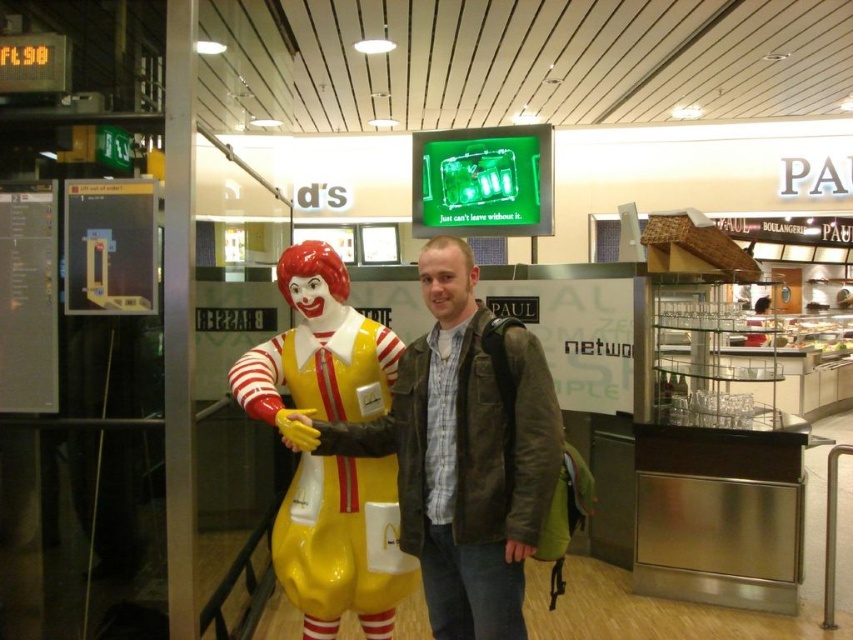
Question: Which point is farther to the camera?

Choices:
 (A) pos(483,497)
 (B) pos(372,467)

Answer: (B)

Question: Is brown leather jacket at center smaller than yellow glossy clown at center?

Choices:
 (A) yes
 (B) no

Answer: (B)

Question: Can you confirm if brown leather jacket at center is positioned above yellow glossy clown at center?

Choices:
 (A) no
 (B) yes

Answer: (B)

Question: Which object appears farthest from the camera in this image?

Choices:
 (A) yellow glossy clown at center
 (B) brown leather jacket at center

Answer: (A)

Question: Which point is closer to the camera?

Choices:
 (A) (345, 531)
 (B) (368, 432)

Answer: (B)

Question: Can you confirm if brown leather jacket at center is wider than yellow glossy clown at center?

Choices:
 (A) yes
 (B) no

Answer: (A)